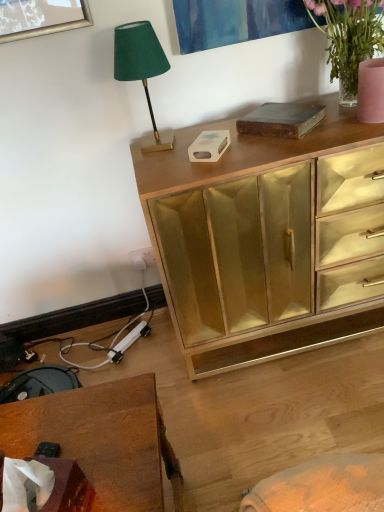
Question: Is wooden desk at lower left located within translucent glass vase at upper right?

Choices:
 (A) yes
 (B) no

Answer: (B)

Question: From a real-world perspective, is translucent glass vase at upper right located beneath wooden desk at lower left?

Choices:
 (A) no
 (B) yes

Answer: (A)

Question: Is the depth of translucent glass vase at upper right less than that of wooden desk at lower left?

Choices:
 (A) no
 (B) yes

Answer: (A)

Question: Considering the relative positions of translucent glass vase at upper right and wooden desk at lower left in the image provided, is translucent glass vase at upper right to the left of wooden desk at lower left from the viewer's perspective?

Choices:
 (A) yes
 (B) no

Answer: (B)

Question: Considering the relative sizes of translucent glass vase at upper right and wooden desk at lower left in the image provided, is translucent glass vase at upper right taller than wooden desk at lower left?

Choices:
 (A) no
 (B) yes

Answer: (A)

Question: From the image's perspective, is gold mirrored cabinet at upper center above or below translucent glass vase at upper right?

Choices:
 (A) above
 (B) below

Answer: (B)

Question: Looking at their shapes, would you say gold mirrored cabinet at upper center is wider or thinner than translucent glass vase at upper right?

Choices:
 (A) wide
 (B) thin

Answer: (A)

Question: Visually, is gold mirrored cabinet at upper center positioned to the left or to the right of translucent glass vase at upper right?

Choices:
 (A) right
 (B) left

Answer: (B)

Question: In terms of height, does gold mirrored cabinet at upper center look taller or shorter compared to translucent glass vase at upper right?

Choices:
 (A) tall
 (B) short

Answer: (A)

Question: Is point (135, 407) positioned closer to the camera than point (150, 65)?

Choices:
 (A) farther
 (B) closer

Answer: (B)

Question: In the image, is wooden desk at lower left positioned in front of or behind green velvet lampshade at upper left?

Choices:
 (A) behind
 (B) front

Answer: (B)

Question: In terms of size, does wooden desk at lower left appear bigger or smaller than green velvet lampshade at upper left?

Choices:
 (A) small
 (B) big

Answer: (B)

Question: Would you say wooden desk at lower left is inside or outside green velvet lampshade at upper left?

Choices:
 (A) outside
 (B) inside

Answer: (A)

Question: Is green velvet lampshade at upper left taller or shorter than wooden desk at lower left?

Choices:
 (A) tall
 (B) short

Answer: (B)

Question: Is point click(x=163, y=142) positioned closer to the camera than point click(x=125, y=438)?

Choices:
 (A) farther
 (B) closer

Answer: (A)